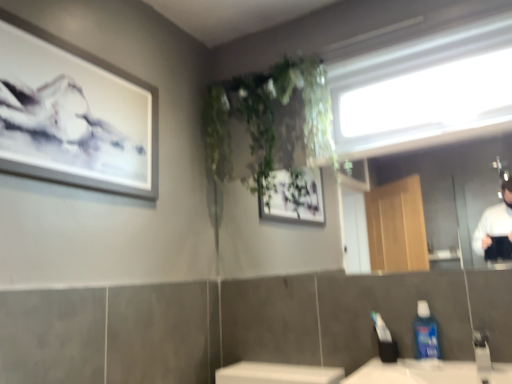
Question: From a real-world perspective, relative to clear glass mirror at upper center, is white matte picture frame at upper left vertically above or below?

Choices:
 (A) above
 (B) below

Answer: (A)

Question: Considering the positions of white matte picture frame at upper left and clear glass mirror at upper center in the image, is white matte picture frame at upper left taller or shorter than clear glass mirror at upper center?

Choices:
 (A) short
 (B) tall

Answer: (B)

Question: Which is nearer to the blue glossy mouthwash at lower right?

Choices:
 (A) transparent glass window at upper center
 (B) white matte picture frame at upper left
 (C) silver metallic faucet at lower right
 (D) clear glass mirror at upper center

Answer: (C)

Question: Which object is positioned closest to the transparent glass window at upper center?

Choices:
 (A) blue glossy mouthwash at lower right
 (B) white matte picture frame at upper left
 (C) silver metallic faucet at lower right
 (D) clear glass mirror at upper center

Answer: (A)